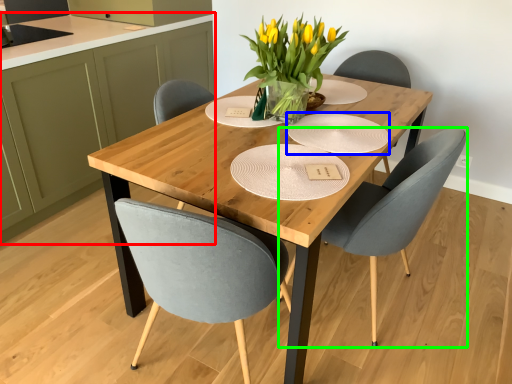
Question: Considering the real-world distances, which object is farthest from cabinetry (highlighted by a red box)? paper plate (highlighted by a blue box) or chair (highlighted by a green box)?

Choices:
 (A) paper plate
 (B) chair

Answer: (B)